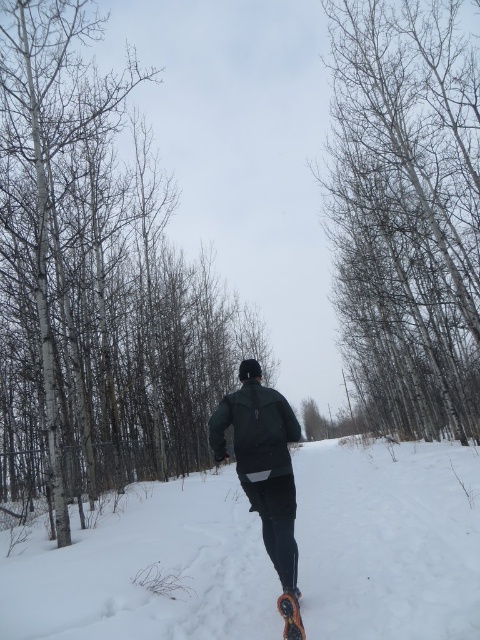
You are planning to take a photo of the smooth white tree at center and the black rubber snowshoe at lower center. Which object appears wider in the photo?

The smooth white tree at center appears wider in the photo because its width surpasses that of the black rubber snowshoe at lower center.

Based on the photo, you are navigating a snowy forest path and want to reach a destination located at point (x=443, y=65). You are currently standing at point (x=194, y=456). Which direction should you move to get closer to your destination?

Since point (x=194, y=456) is closer to the viewer than point (x=443, y=65), you should move away from the viewer to reach your destination.

You are navigating a snowy forest path and see both the smooth white bark at center and the smooth white tree at center. Which one is positioned to the left?

The smooth white bark at center is positioned to the left of the smooth white tree at center.